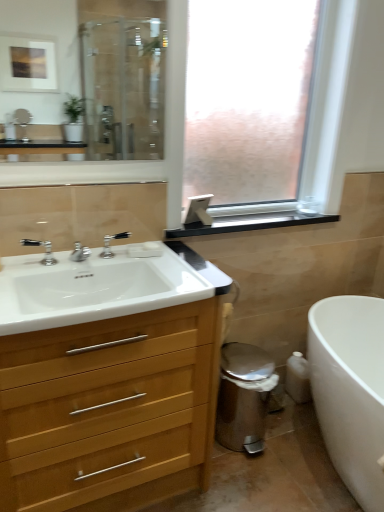
Question: Can you confirm if polished chrome faucet at sink left, positioned as the first tap in front-to-back order, is taller than clear glass mirror at upper left?

Choices:
 (A) yes
 (B) no

Answer: (B)

Question: Is polished chrome faucet at sink left, positioned as the first tap in front-to-back order, positioned beyond the bounds of clear glass mirror at upper left?

Choices:
 (A) yes
 (B) no

Answer: (A)

Question: Is polished chrome faucet at sink left, positioned as the first tap in front-to-back order, smaller than clear glass mirror at upper left?

Choices:
 (A) no
 (B) yes

Answer: (B)

Question: Can you confirm if polished chrome faucet at sink left, arranged as the second tap when viewed from the back, is positioned to the right of clear glass mirror at upper left?

Choices:
 (A) yes
 (B) no

Answer: (B)

Question: Is polished chrome faucet at sink left, positioned as the first tap in front-to-back order, facing towards clear glass mirror at upper left?

Choices:
 (A) no
 (B) yes

Answer: (A)

Question: Is polished chrome faucet at sink left, arranged as the second tap when viewed from the back, behind clear glass mirror at upper left?

Choices:
 (A) no
 (B) yes

Answer: (B)

Question: Is white matte soap at center next to white glossy bathtub at lower right and touching it?

Choices:
 (A) no
 (B) yes

Answer: (A)

Question: Is white matte soap at center turned away from white glossy bathtub at lower right?

Choices:
 (A) yes
 (B) no

Answer: (B)

Question: Is white matte soap at center located outside white glossy bathtub at lower right?

Choices:
 (A) yes
 (B) no

Answer: (A)

Question: From a real-world perspective, is white matte soap at center under white glossy bathtub at lower right?

Choices:
 (A) no
 (B) yes

Answer: (A)

Question: From the image's perspective, would you say white matte soap at center is shown under white glossy bathtub at lower right?

Choices:
 (A) no
 (B) yes

Answer: (A)

Question: Does white matte soap at center come in front of white glossy bathtub at lower right?

Choices:
 (A) no
 (B) yes

Answer: (A)

Question: From the image's perspective, is clear glass mirror at upper left under white glossy bathtub at lower right?

Choices:
 (A) yes
 (B) no

Answer: (B)